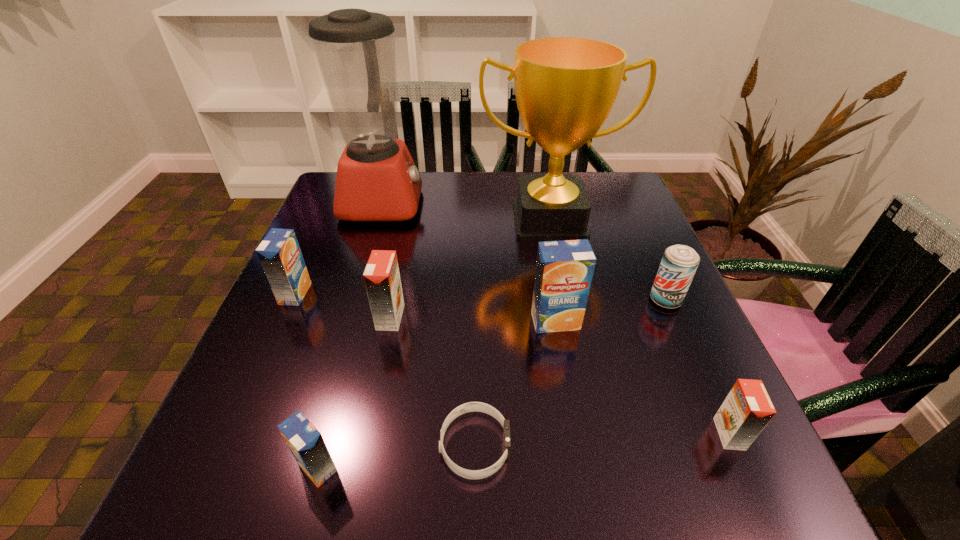
I want to click on blender, so click(377, 180).

Identify the location of gold award. (565, 87).

You are a GUI agent. You are given a task and a screenshot of the screen. Output one action in this format:
    pyautogui.click(x=<x>, y=<y>)
    Task: Click on the second farthest blue orange_juice
    The height and width of the screenshot is (540, 960).
    Given the screenshot: What is the action you would take?
    pyautogui.click(x=564, y=270)

Locate an element on the screen. The height and width of the screenshot is (540, 960). the biggest blue orange_juice is located at coordinates (564, 270).

I want to click on the left orange orange juice, so click(382, 280).

This screenshot has width=960, height=540. I want to click on the farther orange orange juice, so click(x=382, y=280).

I want to click on the second smallest blue orange_juice, so click(x=279, y=253).

This screenshot has width=960, height=540. What are the coordinates of `the leftmost blue orange_juice` in the screenshot? It's located at (279, 253).

Locate an element on the screen. Image resolution: width=960 pixels, height=540 pixels. beer can is located at coordinates (679, 263).

Find the location of a particular element. The height and width of the screenshot is (540, 960). the smallest blue orange_juice is located at coordinates click(x=306, y=443).